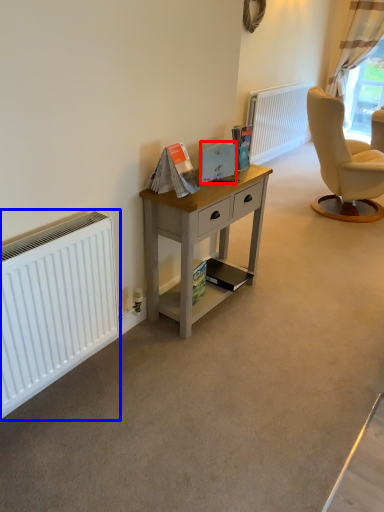
Question: Which point is closer to the camera, magazine (highlighted by a red box) or radiator (highlighted by a blue box)?

Choices:
 (A) magazine
 (B) radiator

Answer: (B)